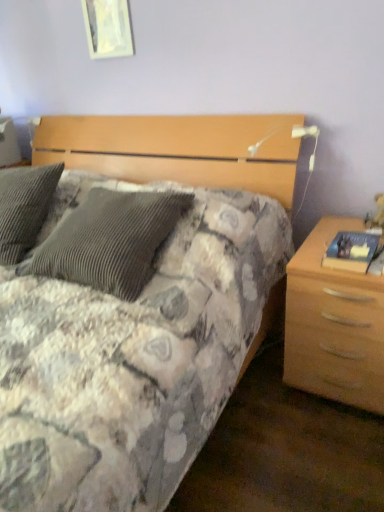
Find the location of a particular element. Image resolution: width=384 pixels, height=512 pixels. vacant region to the left of light wood/texture nightstand at right is located at coordinates click(259, 411).